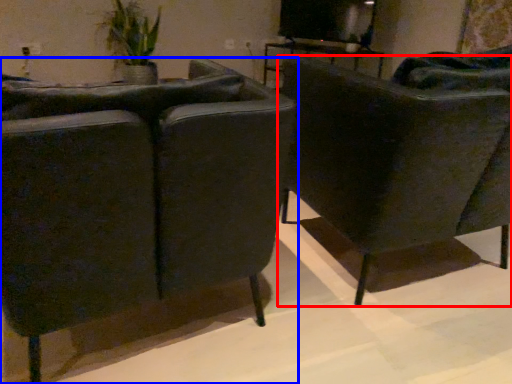
Question: Which point is further to the camera, chair (highlighted by a red box) or chair (highlighted by a blue box)?

Choices:
 (A) chair
 (B) chair

Answer: (A)